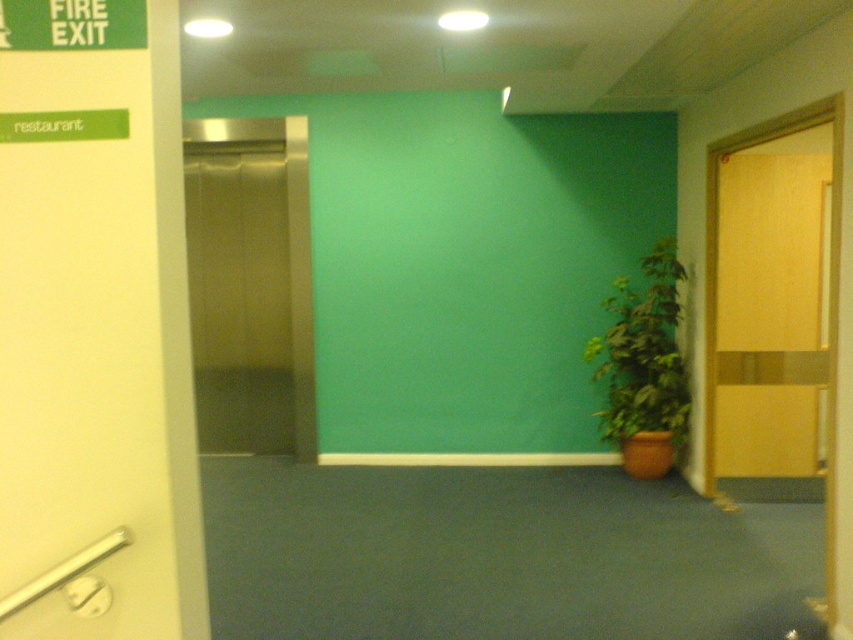
Question: Which of these objects is positioned closest to the wooden at right?

Choices:
 (A) green matte plant at right
 (B) stainless steel elevator at left

Answer: (A)

Question: Is stainless steel elevator at left positioned at the back of green matte plant at right?

Choices:
 (A) yes
 (B) no

Answer: (A)

Question: Is wooden at right above green matte plant at right?

Choices:
 (A) yes
 (B) no

Answer: (A)

Question: Which point appears closest to the camera in this image?

Choices:
 (A) (282, 209)
 (B) (628, 356)

Answer: (B)

Question: Which point is farther from the camera taking this photo?

Choices:
 (A) (311, 342)
 (B) (764, 412)

Answer: (A)

Question: Considering the relative positions of stainless steel elevator at left and green matte plant at right in the image provided, where is stainless steel elevator at left located with respect to green matte plant at right?

Choices:
 (A) below
 (B) above

Answer: (B)